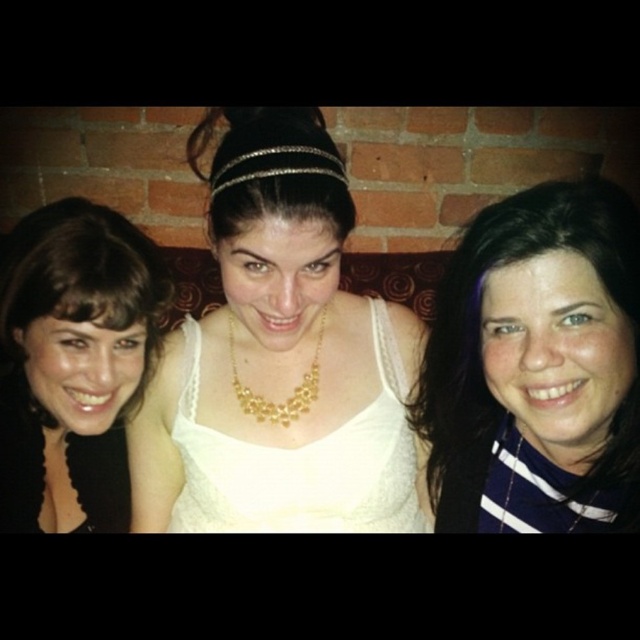
Question: Does dark blue striped shirt at right appear on the right side of matte black hair at left?

Choices:
 (A) no
 (B) yes

Answer: (B)

Question: Which of the following is the farthest from the observer?

Choices:
 (A) (451, 440)
 (B) (314, 358)

Answer: (B)

Question: Which point is closer to the camera taking this photo?

Choices:
 (A) (259, 413)
 (B) (24, 333)

Answer: (B)

Question: Does dark blue striped shirt at right appear under gold metallic necklace at center?

Choices:
 (A) no
 (B) yes

Answer: (B)

Question: Is white lace dress at center smaller than dark blue striped shirt at right?

Choices:
 (A) yes
 (B) no

Answer: (B)

Question: Which object appears closest to the camera in this image?

Choices:
 (A) gold metallic necklace at center
 (B) matte black hair at left
 (C) white lace dress at center
 (D) dark blue striped shirt at right

Answer: (C)